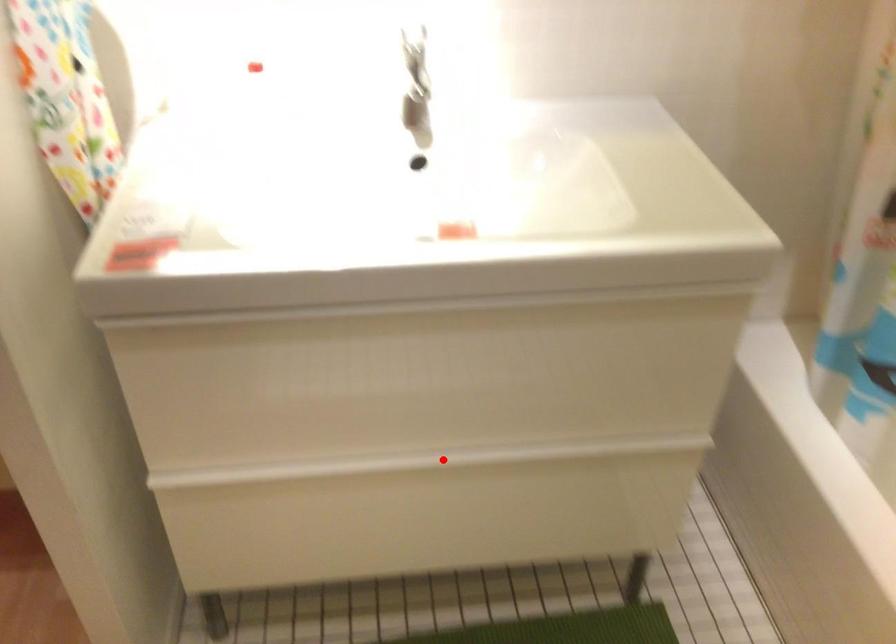
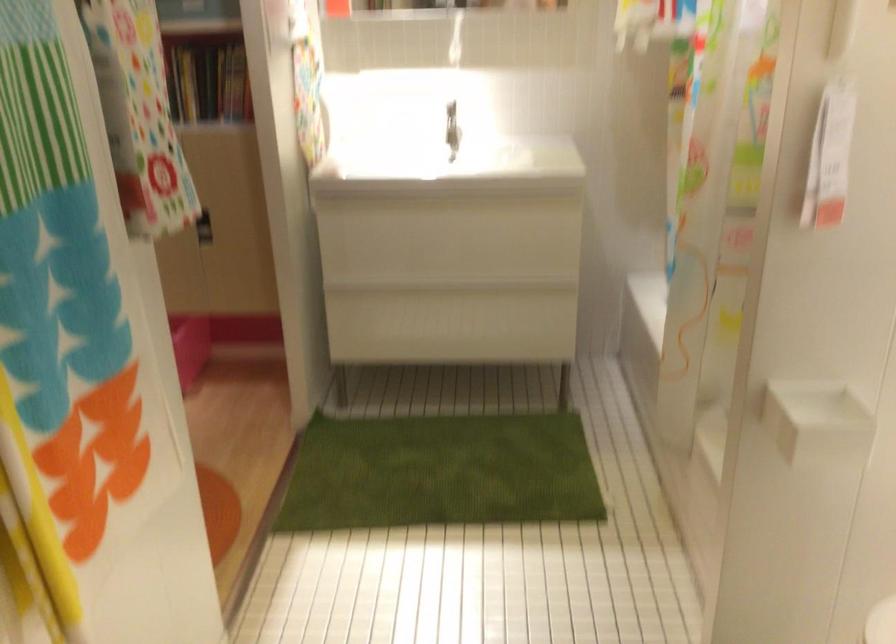
Question: I am providing you with two images of the same scene from different viewpoints. A red point is shown in image1. For the corresponding object point in image2, is it positioned nearer or farther from the camera?

Choices:
 (A) Nearer
 (B) Farther

Answer: (B)